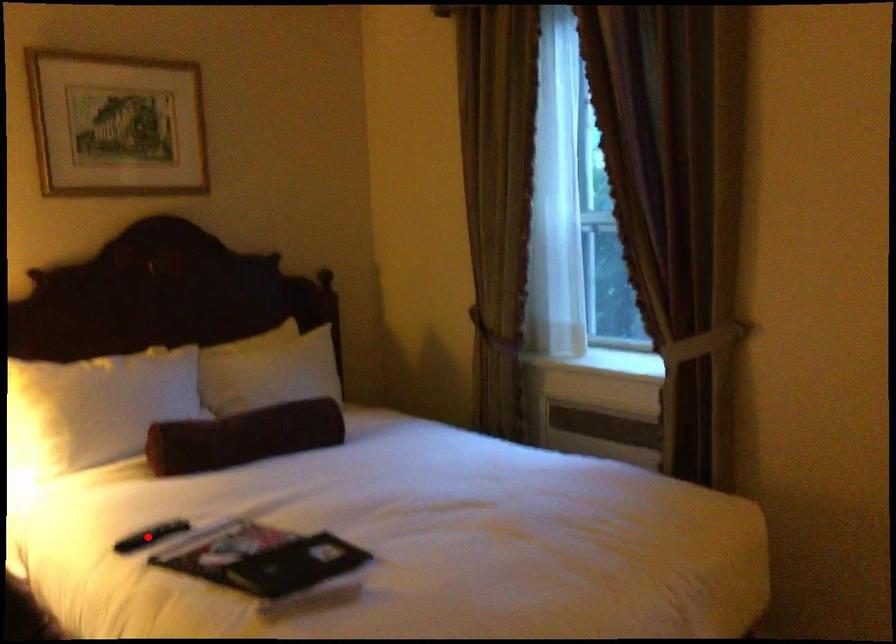
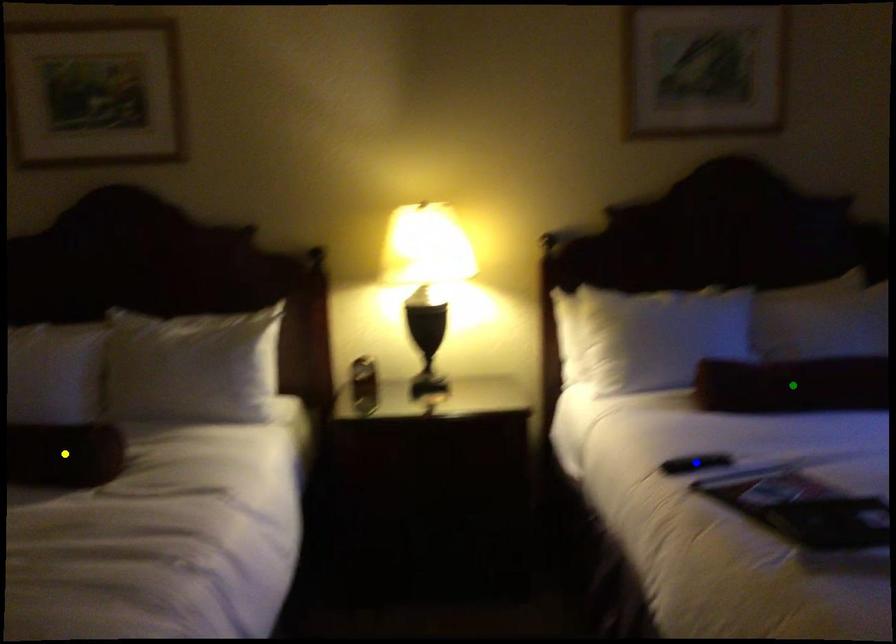
Question: I am providing you with two images of the same scene from different viewpoints. A red point is marked on the first image. You are given multiple points on the second image. Which point in image 2 represents the same 3d spot as the red point in image 1?

Choices:
 (A) green point
 (B) blue point
 (C) yellow point

Answer: (B)